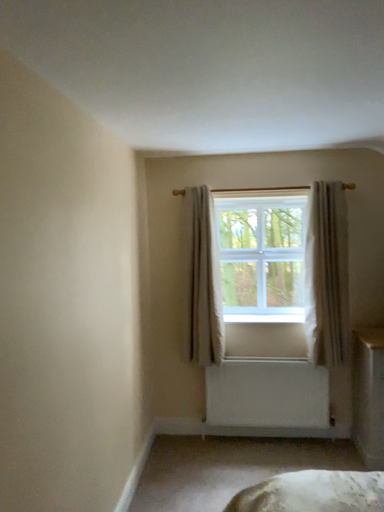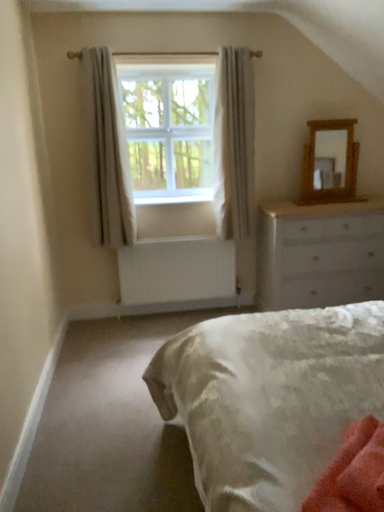
Question: How did the camera likely rotate when shooting the video?

Choices:
 (A) rotated upward
 (B) rotated downward

Answer: (B)